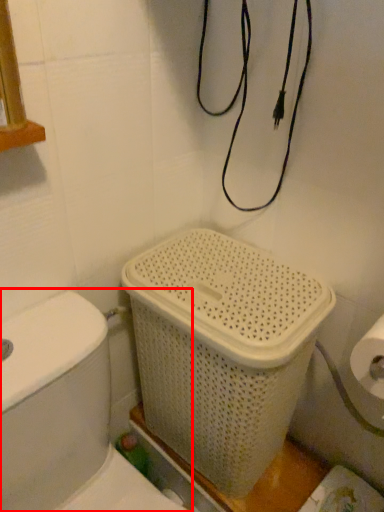
Question: From the image's perspective, where is toilet (annotated by the red box) located in relation to basket container in the image?

Choices:
 (A) below
 (B) above

Answer: (A)